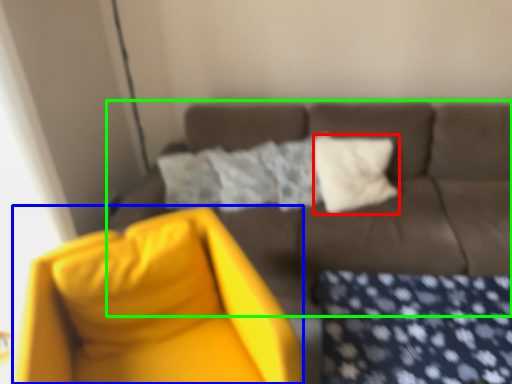
Question: Considering the real-world distances, which object is closest to pillow (highlighted by a red box)? swivel chair (highlighted by a blue box) or studio couch (highlighted by a green box).

Choices:
 (A) swivel chair
 (B) studio couch

Answer: (B)